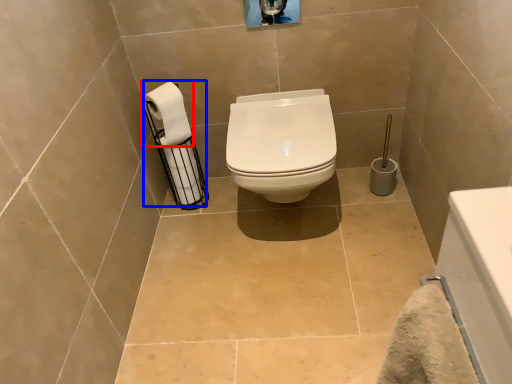
Question: Among these objects, which one is nearest to the camera, toilet paper (highlighted by a red box) or toilet paper (highlighted by a blue box)?

Choices:
 (A) toilet paper
 (B) toilet paper

Answer: (A)